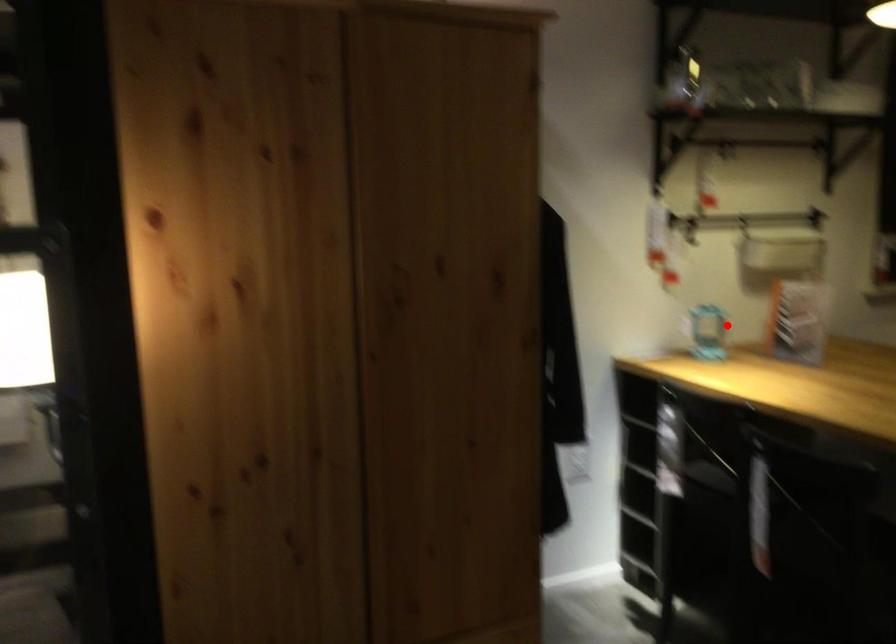
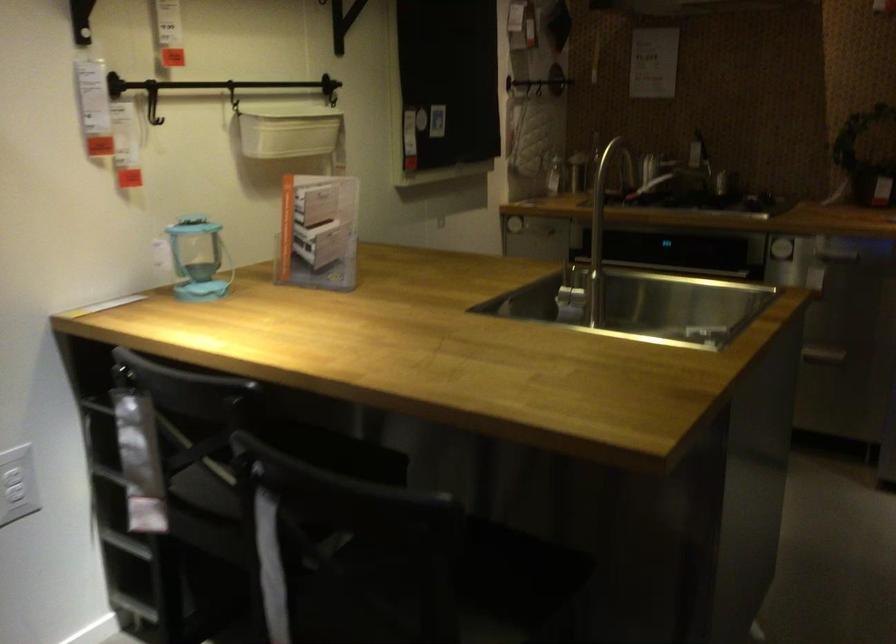
Locate, in the second image, the point that corresponds to the highlighted location in the first image.

(197, 259)